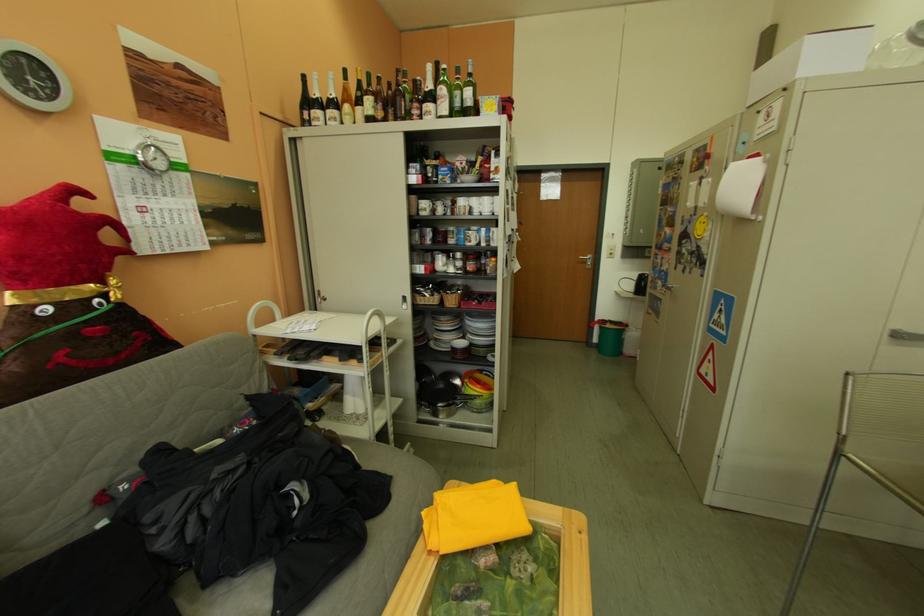
Find the location of a particular element. wooden door handle is located at coordinates pos(588,261).